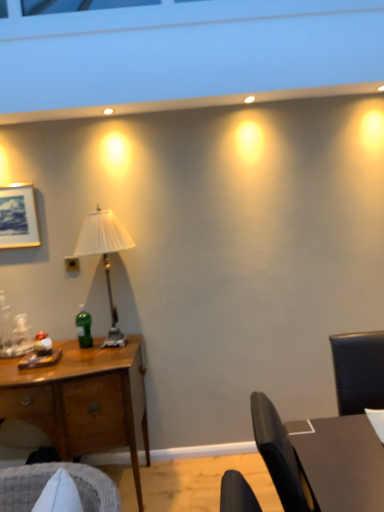
Question: In terms of width, does green glass bottle at center-left look wider or thinner when compared to dark brown wooden table at right?

Choices:
 (A) thin
 (B) wide

Answer: (A)

Question: From a real-world perspective, is green glass bottle at center-left positioned above or below dark brown wooden table at right?

Choices:
 (A) below
 (B) above

Answer: (B)

Question: Which is farther from the wooden desk at left?

Choices:
 (A) green glass bottle at center-left
 (B) white pleated fabric lampshade at left
 (C) dark brown wooden table at right
 (D) black plastic power outlet at center

Answer: (C)

Question: Considering the real-world distances, which object is closest to the black plastic power outlet at center?

Choices:
 (A) dark brown wooden table at right
 (B) green glass bottle at center-left
 (C) wooden desk at left
 (D) white pleated fabric lampshade at left

Answer: (B)